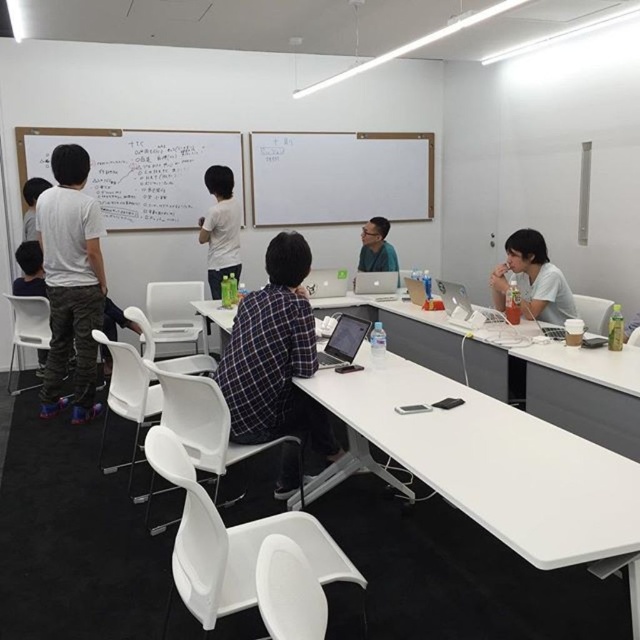
Is white cotton shirt at left smaller than satin black laptop at center?

No, white cotton shirt at left is not smaller than satin black laptop at center.

Is white cotton shirt at left behind satin black laptop at center?

Yes, white cotton shirt at left is behind satin black laptop at center.

Is point (68, 209) less distant than point (342, 336)?

No, it is not.

You are a GUI agent. You are given a task and a screenshot of the screen. Output one action in this format:
    pyautogui.click(x=<x>, y=<y>)
    Task: Click on the white cotton shirt at left
    The image size is (640, 640).
    Given the screenshot: What is the action you would take?
    point(70,280)

Does plaid fabric shirt at center appear on the left side of white matte shirt at upper center?

In fact, plaid fabric shirt at center is to the right of white matte shirt at upper center.

Is the position of plaid fabric shirt at center less distant than that of white matte shirt at upper center?

Yes, plaid fabric shirt at center is closer to the viewer.

The height and width of the screenshot is (640, 640). What do you see at coordinates (275, 356) in the screenshot?
I see `plaid fabric shirt at center` at bounding box center [275, 356].

Locate an element on the screen. Image resolution: width=640 pixels, height=640 pixels. plaid fabric shirt at center is located at coordinates (275, 356).

From the picture: Is the position of matte white shirt at right more distant than that of white matte shirt at upper center?

No, matte white shirt at right is in front of white matte shirt at upper center.

Is point (497, 300) behind point (208, 224)?

No, (497, 300) is in front of (208, 224).

Find the location of a particular element. This screenshot has height=640, width=640. matte white shirt at right is located at coordinates (532, 280).